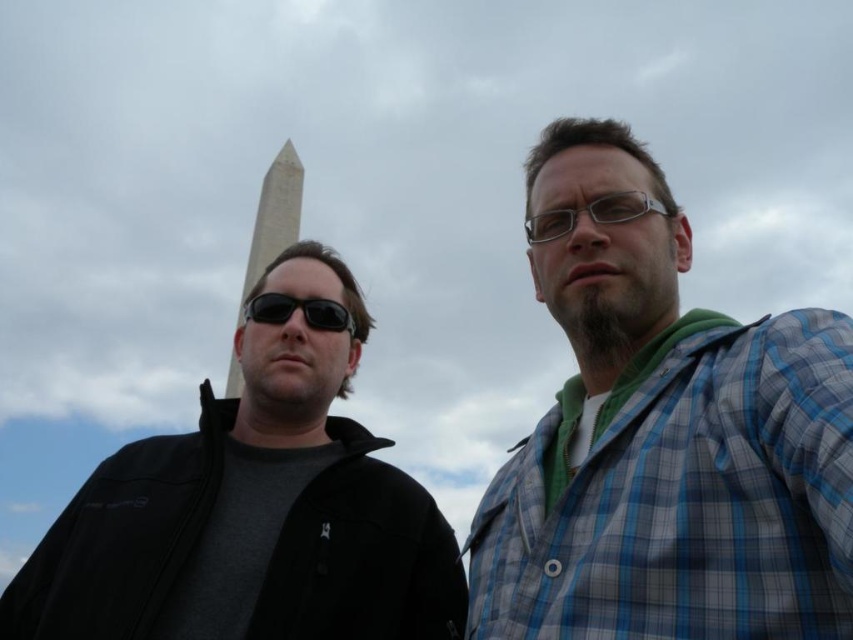
You are a photographer standing at the base of the obelisk structure. You want to take a photo of the two people in the scene, who are positioned at the base of the monument. The blue plaid shirt at center is 28.85 meters away from you. Can you capture both individuals in a single frame without moving your camera? Explain your reasoning.

The blue plaid shirt at center is 28.85 meters away from the photographer. Since the two individuals are positioned together at the base of the monument, the photographer can likely capture both in a single frame without moving the camera, as they are at the same distance and within the camera lens field of view.

You are a photographer trying to capture a clear shot of both the black matte jacket at left and the black matte sunglasses at center. Since you want to ensure both are visible, which object should you focus on first to account for their sizes?

The black matte jacket at left is bigger than the black matte sunglasses at center, so you should focus on the black matte jacket at left first to ensure it is in clear view before adjusting for the smaller sunglasses.